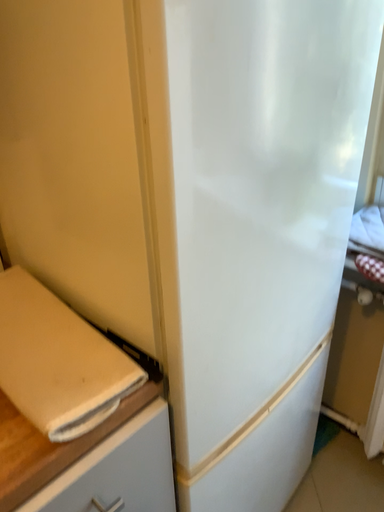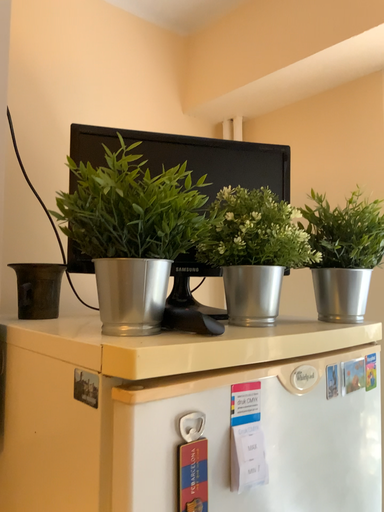
Question: Which way did the camera rotate in the video?

Choices:
 (A) rotated downward
 (B) rotated upward

Answer: (B)